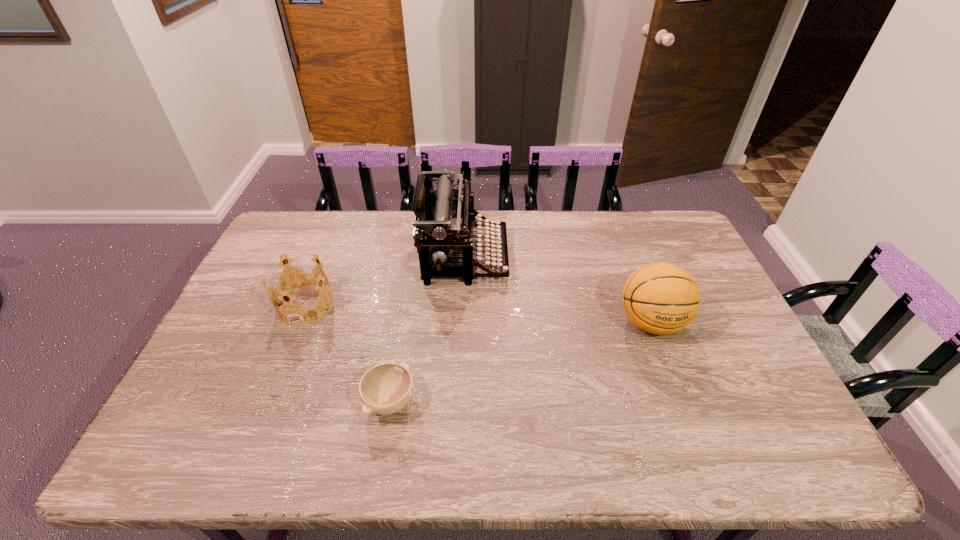
Locate an element on the screen. This screenshot has height=540, width=960. vacant point located 0.240m on the right of the bowl is located at coordinates (513, 401).

This screenshot has width=960, height=540. In order to click on object at the far edge in this screenshot , I will do (444, 222).

The image size is (960, 540). What are the coordinates of `object situated at the left edge` in the screenshot? It's located at (296, 282).

I want to click on object that is at the right edge, so click(661, 298).

In the image, there is a desktop. Where is `vacant space at the far edge`? vacant space at the far edge is located at coordinates (550, 241).

Locate an element on the screen. vacant space at the near edge is located at coordinates (388, 461).

This screenshot has height=540, width=960. In the image, there is a desktop. What are the coordinates of `vacant space at the left edge` in the screenshot? It's located at click(x=261, y=330).

Image resolution: width=960 pixels, height=540 pixels. In the image, there is a desktop. Identify the location of free space at the right edge. (726, 308).

In the image, there is a desktop. Identify the location of vacant area at the near left corner. (214, 461).

This screenshot has height=540, width=960. What are the coordinates of `free space at the far right corner of the desktop` in the screenshot? It's located at (661, 226).